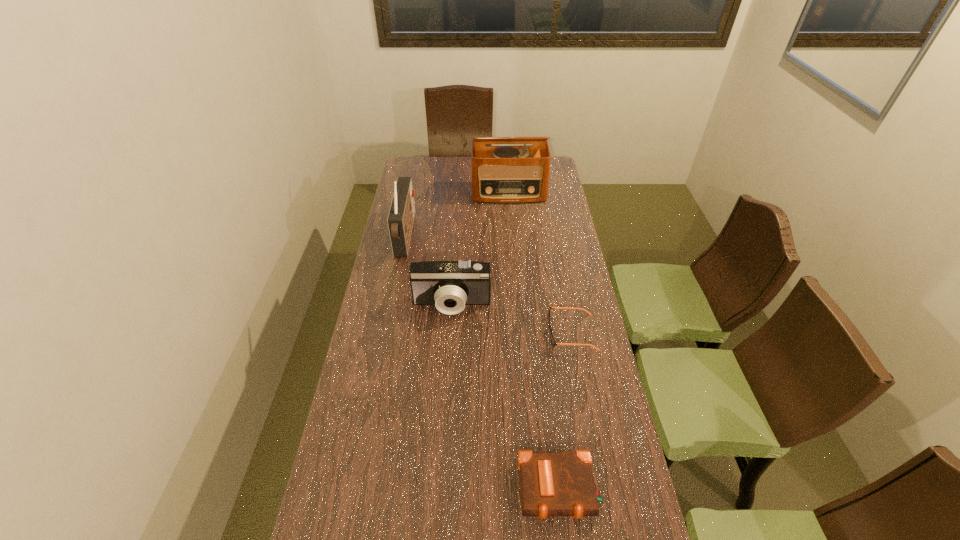
Locate an element on the screen. Image resolution: width=960 pixels, height=540 pixels. unoccupied position between the camcorder and the fourth tallest object is located at coordinates (506, 397).

Find the location of a particular element. The width and height of the screenshot is (960, 540). object that is the third closest to the leftmost object is located at coordinates (554, 343).

Identify the location of object that stands as the third closest to the third tallest object. (551, 483).

Where is `vacant space that satisfies the following two spatial constraints: 1. on the front panel of the farther radio receiver; 2. on the front panel of the leftmost object`? vacant space that satisfies the following two spatial constraints: 1. on the front panel of the farther radio receiver; 2. on the front panel of the leftmost object is located at coordinates (513, 235).

Image resolution: width=960 pixels, height=540 pixels. In order to click on free spot that satisfies the following two spatial constraints: 1. on the front-facing side of the spectacles; 2. on the spine side of the nearest object in this screenshot , I will do `click(601, 489)`.